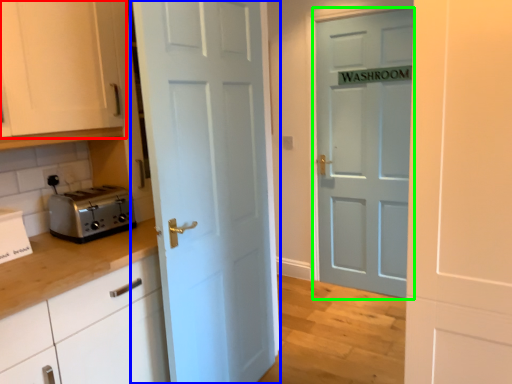
Question: Which object is positioned farthest from cabinetry (highlighted by a red box)? Select from door (highlighted by a blue box) and door (highlighted by a green box).

Choices:
 (A) door
 (B) door

Answer: (B)